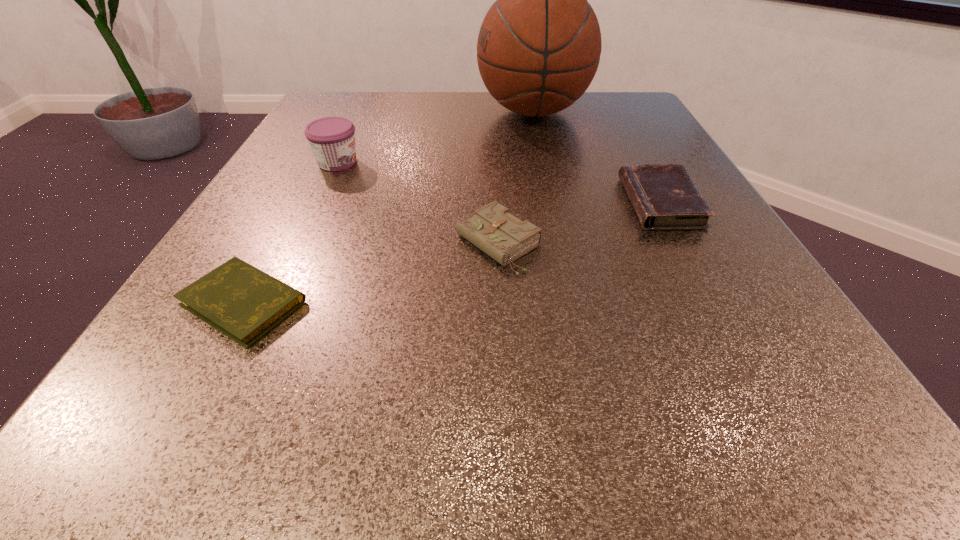
This screenshot has height=540, width=960. Identify the location of vacant space in between the second diary from right to left and the shortest diary. (371, 273).

You are a GUI agent. You are given a task and a screenshot of the screen. Output one action in this format:
    pyautogui.click(x=<x>, y=<y>)
    Task: Click on the free area in between the farthest object and the jam
    The height and width of the screenshot is (540, 960).
    Given the screenshot: What is the action you would take?
    pyautogui.click(x=436, y=137)

You are a GUI agent. You are given a task and a screenshot of the screen. Output one action in this format:
    pyautogui.click(x=<x>, y=<y>)
    Task: Click on the empty space between the second diary from right to left and the basketball
    The width and height of the screenshot is (960, 540).
    Given the screenshot: What is the action you would take?
    pyautogui.click(x=516, y=178)

Find the location of a particular element. vacant area that lies between the shortest diary and the second diary from right to left is located at coordinates (371, 273).

Image resolution: width=960 pixels, height=540 pixels. I want to click on vacant area that lies between the jam and the rightmost diary, so click(499, 183).

Where is `vacant area that lies between the second farthest object and the farthest object`? This screenshot has width=960, height=540. vacant area that lies between the second farthest object and the farthest object is located at coordinates [436, 137].

You are a GUI agent. You are given a task and a screenshot of the screen. Output one action in this format:
    pyautogui.click(x=<x>, y=<y>)
    Task: Click on the vacant area between the shortest object and the second diary from right to left
    The width and height of the screenshot is (960, 540).
    Given the screenshot: What is the action you would take?
    pyautogui.click(x=371, y=273)

Identify the location of object that stands as the third closest to the second diary from left to right. (332, 139).

Find the location of a particular element. The image size is (960, 540). object identified as the fourth closest to the second tallest object is located at coordinates 664,196.

Locate which diary ranks third in proximity to the second farthest object. Please provide its 2D coordinates. Your answer should be formatted as a tuple, i.e. [(x, y)], where the tuple contains the x and y coordinates of a point satisfying the conditions above.

[(664, 196)]